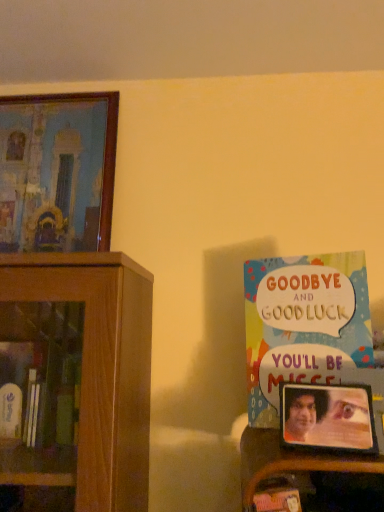
Question: From a real-world perspective, is metallic silver photo frame at right, the second picture frame from the top, physically located above or below wooden framed painting at upper left, the first picture frame when ordered from back to front?

Choices:
 (A) above
 (B) below

Answer: (B)

Question: From the image's perspective, relative to wooden framed painting at upper left, the first picture frame when ordered from back to front, is metallic silver photo frame at right, the second picture frame from the top, above or below?

Choices:
 (A) below
 (B) above

Answer: (A)

Question: Considering the real-world distances, which object is farthest from the wooden framed painting at upper left, placed as the first picture frame when sorted from top to bottom?

Choices:
 (A) metallic silver photo frame at right, the second picture frame from the top
 (B) multicolored paper book at right

Answer: (A)

Question: Estimate the real-world distances between objects in this image. Which object is closer to the metallic silver photo frame at right, the second picture frame in the back-to-front sequence?

Choices:
 (A) multicolored paper book at right
 (B) wooden framed painting at upper left, marked as the second picture frame in a right-to-left arrangement

Answer: (A)